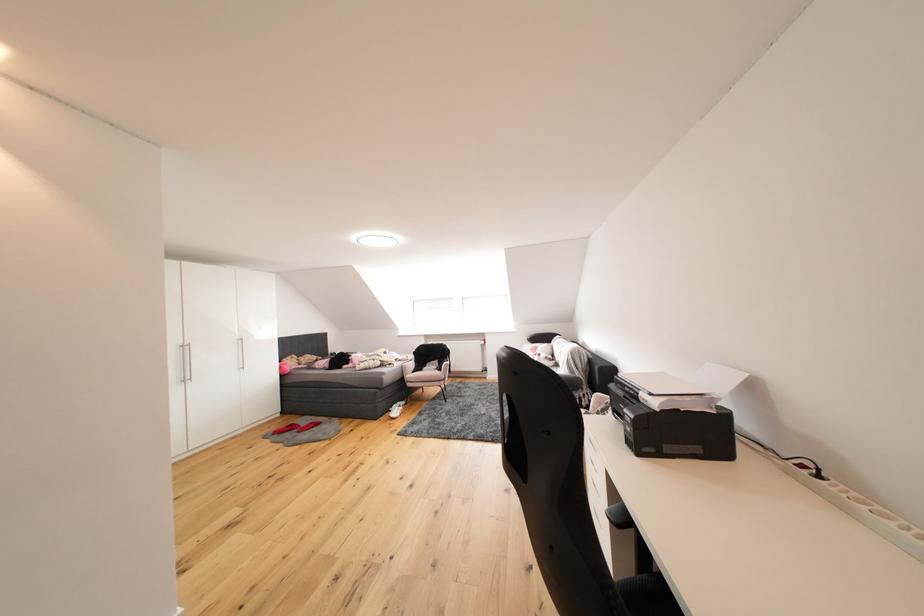
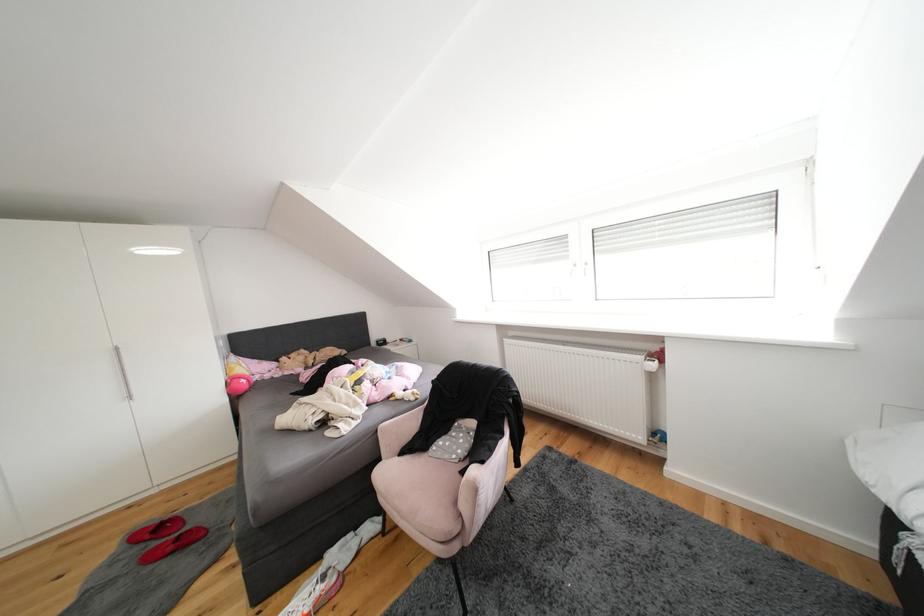
Locate, in the second image, the point that corresponds to the point at 409,411 in the first image.

(331, 592)